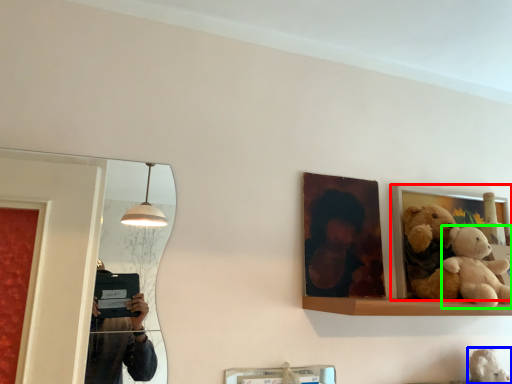
Question: Considering the real-world distances, which object is closest to picture frame (highlighted by a red box)? teddy (highlighted by a blue box) or teddy bear (highlighted by a green box).

Choices:
 (A) teddy
 (B) teddy bear

Answer: (B)